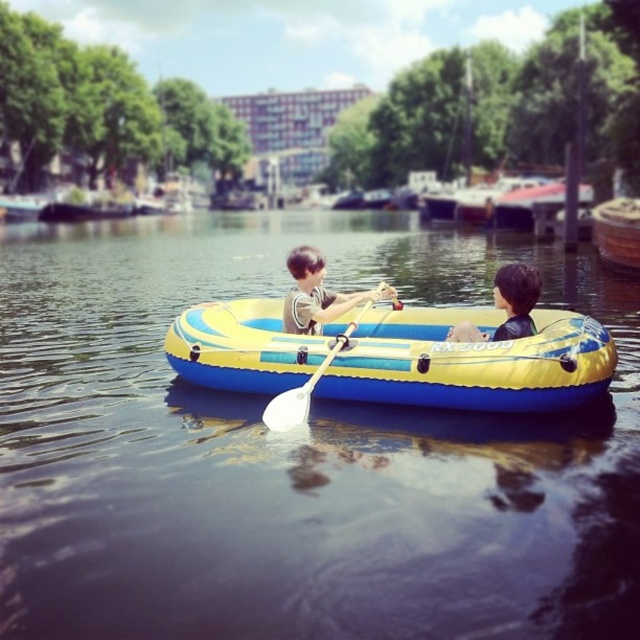
Is yellow/blue rubber boat at center thinner than white plastic paddle at center?

Correct, yellow/blue rubber boat at center's width is less than white plastic paddle at center's.

Is point (344, 314) positioned in front of point (339, 349)?

No, (344, 314) is behind (339, 349).

You are a GUI agent. You are given a task and a screenshot of the screen. Output one action in this format:
    pyautogui.click(x=<x>, y=<y>)
    Task: Click on the yellow/blue rubber boat at center
    This screenshot has width=640, height=640.
    Given the screenshot: What is the action you would take?
    pyautogui.click(x=396, y=356)

Is blue rubber boat at center thinner than yellow/blue rubber boat at center?

No.

Between blue rubber boat at center and yellow/blue rubber boat at center, which one appears on the right side from the viewer's perspective?

Positioned to the right is yellow/blue rubber boat at center.

The image size is (640, 640). I want to click on blue rubber boat at center, so click(x=294, y=451).

This screenshot has width=640, height=640. Identify the location of blue rubber boat at center. (294, 451).

Can you confirm if matte black shirt at center is taller than smooth brown hair at center?

No, matte black shirt at center is not taller than smooth brown hair at center.

Is matte black shirt at center to the right of smooth brown hair at center from the viewer's perspective?

Incorrect, matte black shirt at center is not on the right side of smooth brown hair at center.

Describe the element at coordinates (317, 292) in the screenshot. This screenshot has height=640, width=640. I see `matte black shirt at center` at that location.

Find the location of a particular element. This screenshot has height=640, width=640. matte black shirt at center is located at coordinates (317, 292).